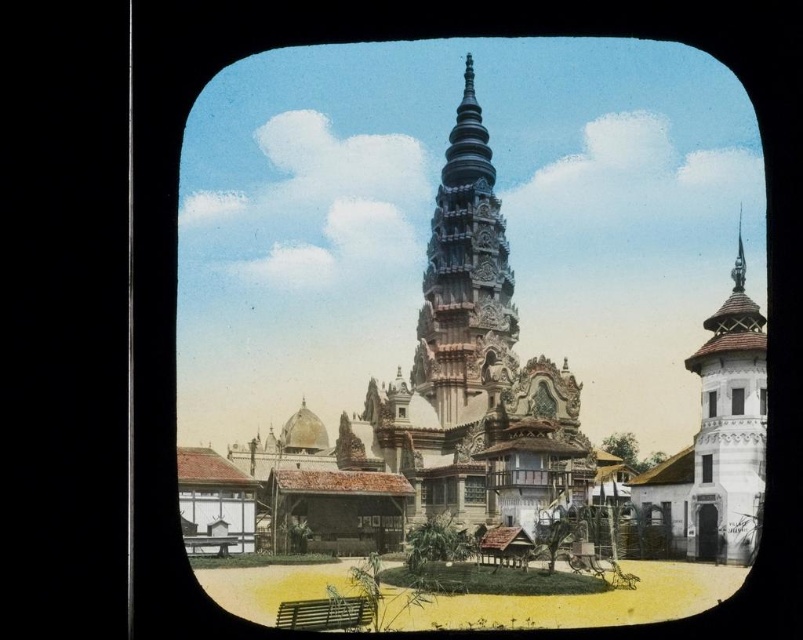
You are an architect designing a new addition to this temple complex. You need to ensure that the new structure does not block the view of the shiny silver spire at upper right from the black glass window at upper right. Given their relative heights, what should you consider about the placement of the new building?

The shiny silver spire at upper right is taller than the black glass window at upper right. To avoid blocking the view of the spire from the window, the new structure should be placed in a location where its height does not obstruct the line of sight between the window and the spire, considering the spire is taller.

You are an architect analyzing the symmetry of the structures in the image. Given the shiny silver spire at upper right and the white painted wood window at upper right, which one has a greater width?

The shiny silver spire at upper right has a greater width than the white painted wood window at upper right.